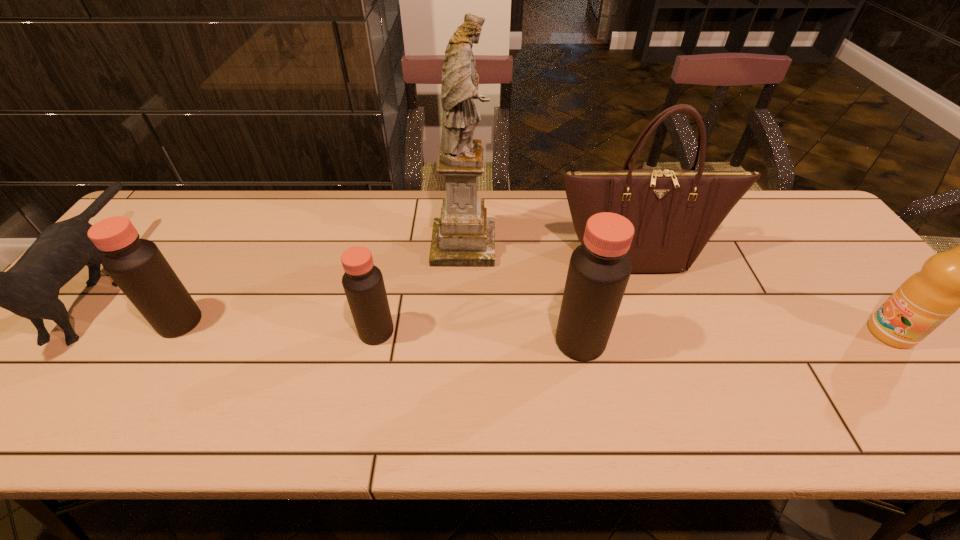
Where is `the leftmost vinegar`? This screenshot has width=960, height=540. the leftmost vinegar is located at coordinates (137, 266).

Image resolution: width=960 pixels, height=540 pixels. Find the location of `the second shortest vinegar`. the second shortest vinegar is located at coordinates (137, 266).

At what (x,y) coordinates should I click in order to perform the action: click on the second vinegar from left to right. Please return your answer as a coordinate pair (x, y). Looking at the image, I should click on (363, 283).

At what (x,y) coordinates should I click in order to perform the action: click on the shortest vinegar. Please return your answer as a coordinate pair (x, y). Looking at the image, I should click on (363, 283).

Find the location of `the rightmost vinegar`. the rightmost vinegar is located at coordinates (599, 270).

I want to click on sculpture, so click(463, 236).

What are the coordinates of `the tallest object` in the screenshot? It's located at (463, 236).

Find the location of a particular element. The image size is (960, 540). fruit juice is located at coordinates (957, 278).

I want to click on cat, so click(30, 289).

Image resolution: width=960 pixels, height=540 pixels. Identify the location of the sixth shortest object. coord(674,212).